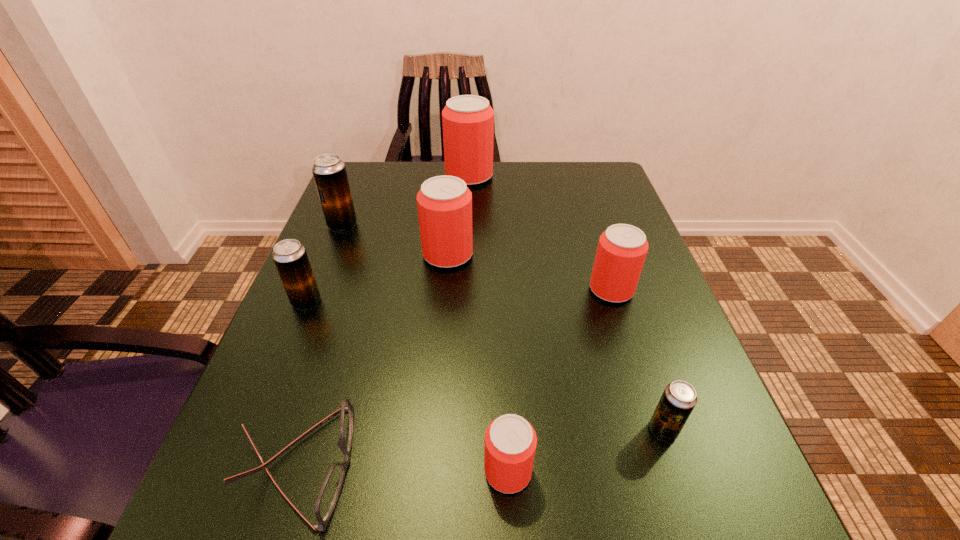
Where is `free location located on the right of the smallest red beer can`? Image resolution: width=960 pixels, height=540 pixels. free location located on the right of the smallest red beer can is located at coordinates (613, 471).

Identify the location of vacant space located 0.360m on the front-facing side of the spectacles. (613, 464).

The image size is (960, 540). I want to click on object at the far edge, so click(468, 120).

Identify the location of beer can present at the near edge. Image resolution: width=960 pixels, height=540 pixels. (510, 441).

You are a GUI agent. You are given a task and a screenshot of the screen. Output one action in this format:
    pyautogui.click(x=<x>, y=<y>)
    Task: Click on the spectacles that is at the near edge
    The height and width of the screenshot is (540, 960).
    Given the screenshot: What is the action you would take?
    pyautogui.click(x=329, y=492)

Where is `spectacles that is at the left edge`? spectacles that is at the left edge is located at coordinates (329, 492).

Find the location of a particular element. object present at the near left corner is located at coordinates (329, 492).

Find the location of a particular element. Image resolution: width=960 pixels, height=540 pixels. vacant space at the far edge of the desktop is located at coordinates coord(523,167).

This screenshot has width=960, height=540. I want to click on free region at the near edge of the desktop, so click(372, 524).

Where is `vacant region at the left edge of the desktop`? The image size is (960, 540). vacant region at the left edge of the desktop is located at coordinates (332, 438).